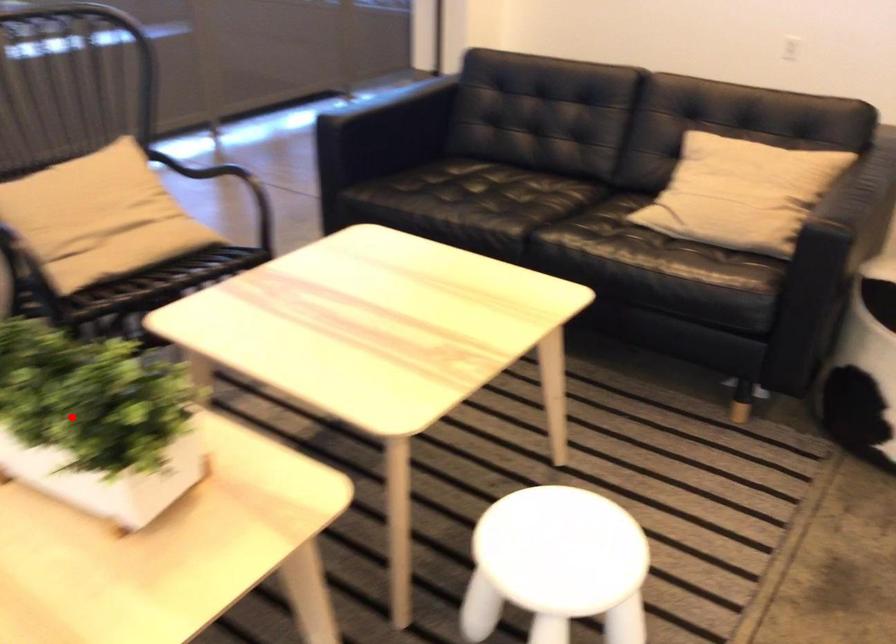
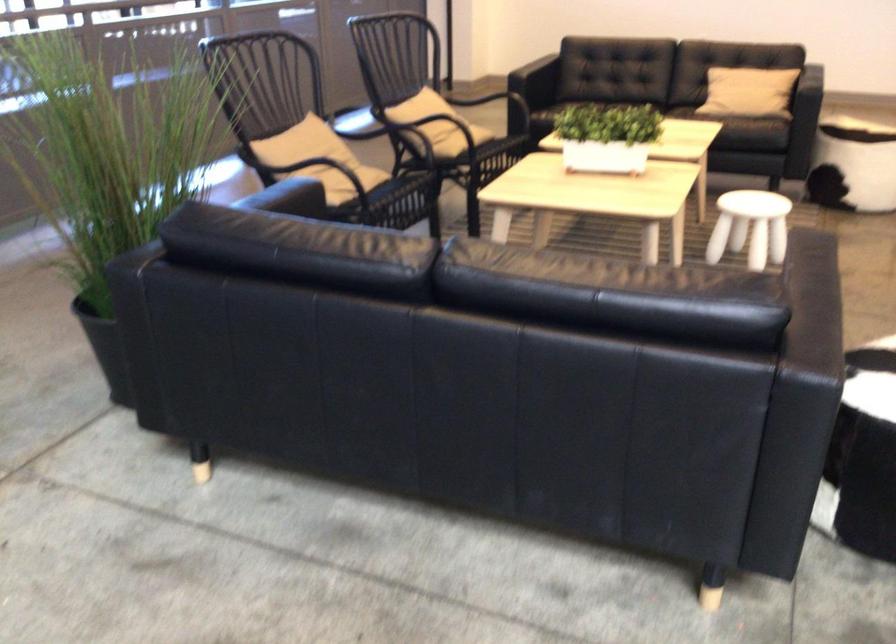
Where in the second image is the point corresponding to the highlighted location from the first image?

(607, 137)